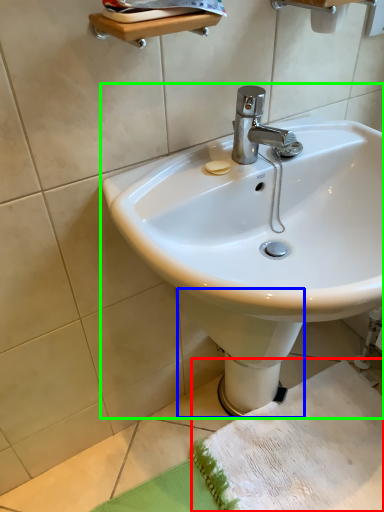
Question: Which object is the closest to the beach towel (highlighted by a red box)? Choose among these: bidet (highlighted by a blue box) or sink (highlighted by a green box).

Choices:
 (A) bidet
 (B) sink

Answer: (A)